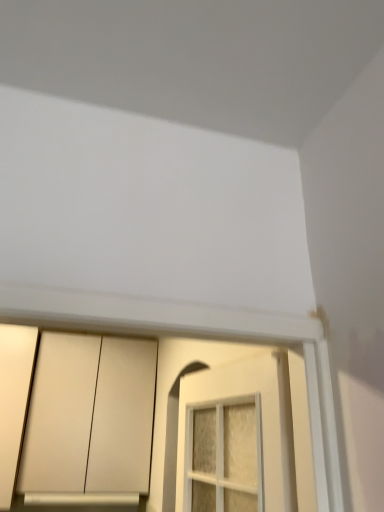
Question: Can you confirm if matte white cabinet at lower left is positioned to the right of matte white door at lower left?

Choices:
 (A) no
 (B) yes

Answer: (B)

Question: Is matte white cabinet at lower left located outside matte white door at lower left?

Choices:
 (A) no
 (B) yes

Answer: (B)

Question: Is matte white cabinet at lower left far away from matte white door at lower left?

Choices:
 (A) yes
 (B) no

Answer: (B)

Question: Considering the relative sizes of matte white cabinet at lower left and matte white door at lower left in the image provided, is matte white cabinet at lower left thinner than matte white door at lower left?

Choices:
 (A) yes
 (B) no

Answer: (B)

Question: Is matte white cabinet at lower left smaller than matte white door at lower left?

Choices:
 (A) yes
 (B) no

Answer: (B)

Question: From the image's perspective, is matte white cabinet at lower left beneath matte white door at lower left?

Choices:
 (A) yes
 (B) no

Answer: (A)

Question: Can you confirm if matte white door at lower left is thinner than matte white cabinet at lower left?

Choices:
 (A) yes
 (B) no

Answer: (A)

Question: From a real-world perspective, is matte white door at lower left below matte white cabinet at lower left?

Choices:
 (A) yes
 (B) no

Answer: (A)

Question: Can you confirm if matte white door at lower left is bigger than matte white cabinet at lower left?

Choices:
 (A) yes
 (B) no

Answer: (B)

Question: Is matte white cabinet at lower left completely or partially inside matte white door at lower left?

Choices:
 (A) no
 (B) yes

Answer: (A)

Question: Is matte white door at lower left shorter than matte white cabinet at lower left?

Choices:
 (A) yes
 (B) no

Answer: (B)

Question: Is matte white door at lower left in contact with matte white cabinet at lower left?

Choices:
 (A) no
 (B) yes

Answer: (A)

Question: Is silver metallic window sill at lower center not within matte white door at lower left?

Choices:
 (A) yes
 (B) no

Answer: (A)